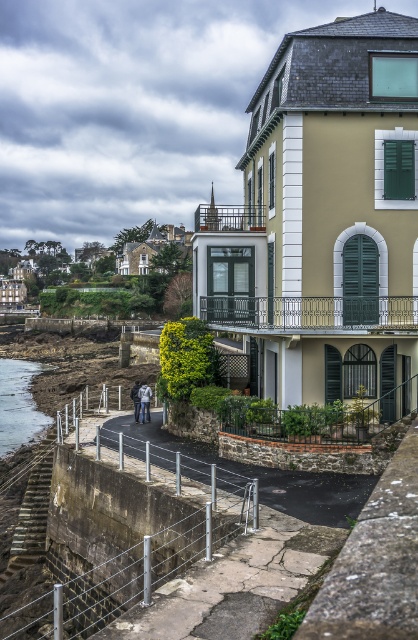
Between green matte shutter at upper right and dark gray jacket at lower center, which one has more height?

Standing taller between the two is dark gray jacket at lower center.

Can you confirm if green matte shutter at upper right is shorter than dark gray jacket at lower center?

Correct, green matte shutter at upper right is not as tall as dark gray jacket at lower center.

This screenshot has height=640, width=418. Identify the location of green matte shutter at upper right. (399, 170).

Locate an element on the screen. green matte shutter at upper right is located at coordinates (399, 170).

Is point (50, 364) positioned in front of point (392, 189)?

No, (50, 364) is further to viewer.

Identify the location of clear water at lower left. (18, 403).

Does green matte shutter at upper right appear under denim jacket at lower left?

No, green matte shutter at upper right is not below denim jacket at lower left.

From the picture: How distant is green matte shutter at upper right from denim jacket at lower left?

green matte shutter at upper right and denim jacket at lower left are 40.27 feet apart.

Is point (402, 141) closer to camera compared to point (142, 400)?

Yes, it is.

This screenshot has width=418, height=640. Find the location of `green matte shutter at upper right`. green matte shutter at upper right is located at coordinates (399, 170).